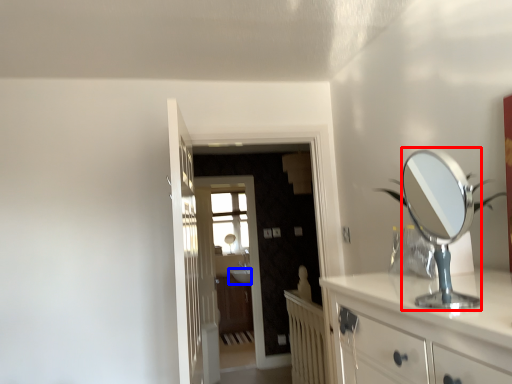
Question: Which point is closer to the camera, mirror (highlighted by a red box) or sink (highlighted by a blue box)?

Choices:
 (A) mirror
 (B) sink

Answer: (A)